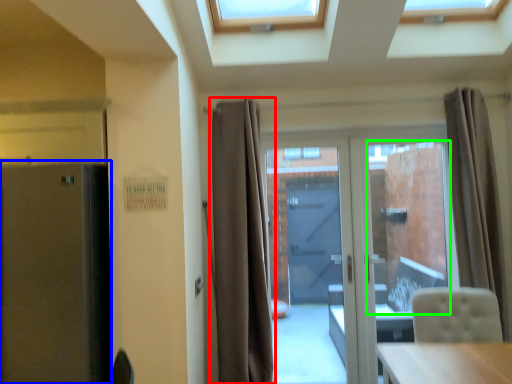
Question: Based on their relative distances, which object is farther from curtain (highlighted by a red box)? Choose from fridge (highlighted by a blue box) and window screen (highlighted by a green box).

Choices:
 (A) fridge
 (B) window screen

Answer: (B)